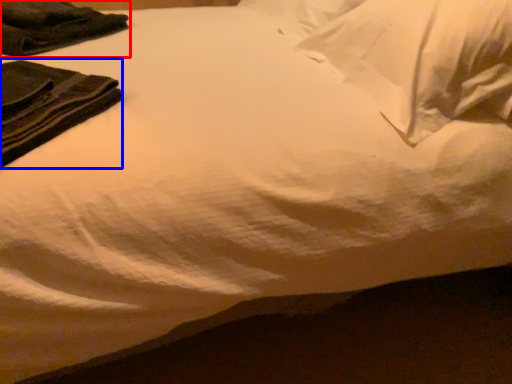
Question: Which object is closer to the camera taking this photo, clothing (highlighted by a red box) or clothing (highlighted by a blue box)?

Choices:
 (A) clothing
 (B) clothing

Answer: (B)